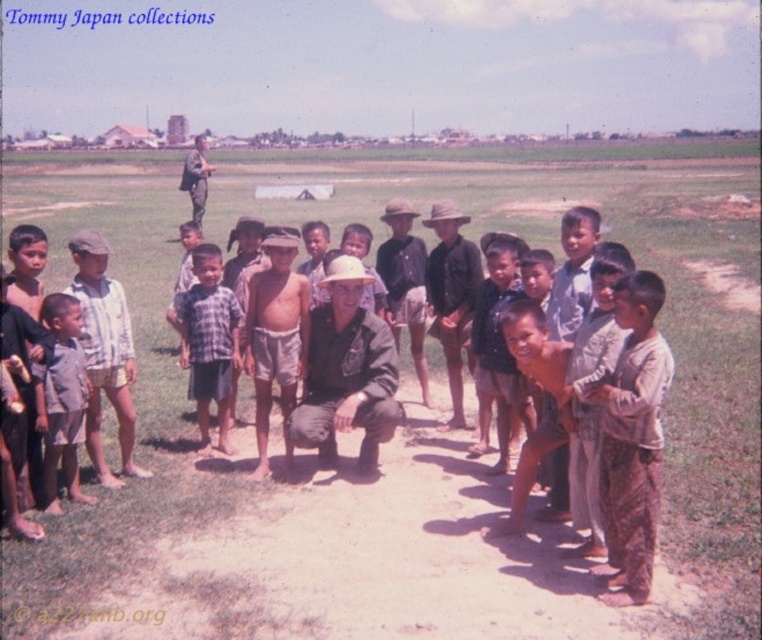
Question: Which object appears closest to the camera in this image?

Choices:
 (A) brown woven pants at lower right
 (B) light brown shorts at center
 (C) brown leather hat at center

Answer: (A)

Question: Which object is the farthest from the light brown shorts at center?

Choices:
 (A) brown woven pants at lower right
 (B) light brown cotton shirt at lower left
 (C) checkered fabric shirt at center
 (D) striped cotton shirt at center

Answer: (A)

Question: Is brown woven pants at lower right thinner than striped cotton shirt at center?

Choices:
 (A) yes
 (B) no

Answer: (A)

Question: Which point is farther to the camera?

Choices:
 (A) (98, 355)
 (B) (458, 301)
 (C) (85, 378)
 (D) (652, 300)

Answer: (B)

Question: Is brown woven pants at lower right to the left of checkered fabric shirt at center from the viewer's perspective?

Choices:
 (A) no
 (B) yes

Answer: (A)

Question: Is checkered fabric shirt at center above brown leather hat at center?

Choices:
 (A) no
 (B) yes

Answer: (A)